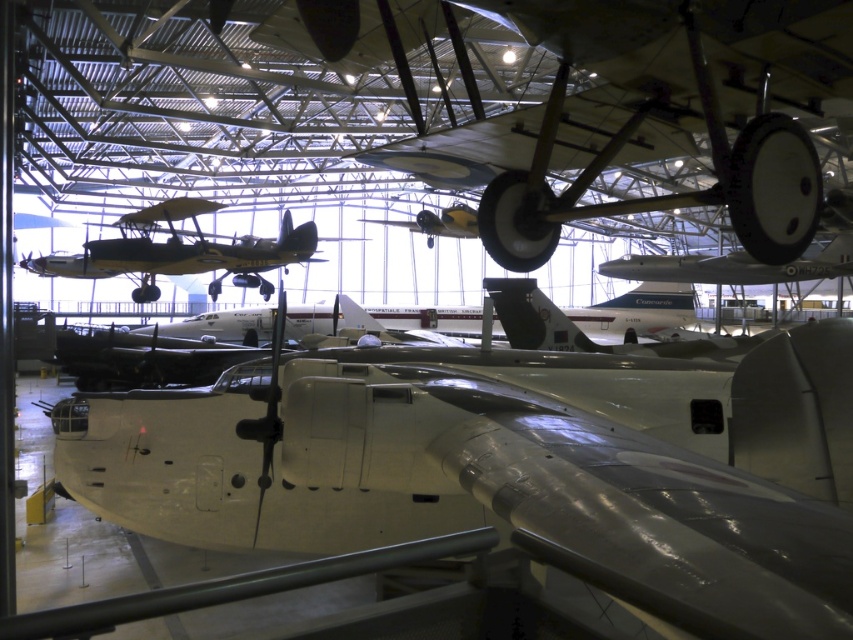
Question: Is the position of metallic silver airplane at center more distant than that of shiny silver airplane at center?

Choices:
 (A) yes
 (B) no

Answer: (B)

Question: Among these points, which one is farthest from the camera?

Choices:
 (A) (306, 224)
 (B) (467, 228)

Answer: (B)

Question: Estimate the real-world distances between objects in this image. Which object is closer to the metallic silver airplane at center?

Choices:
 (A) yellow matte airplane at center
 (B) shiny silver airplane at center

Answer: (B)

Question: Is metallic silver airplane at center wider than shiny silver airplane at center?

Choices:
 (A) no
 (B) yes

Answer: (B)

Question: Which point is closer to the camera?

Choices:
 (A) [662, 582]
 (B) [427, 243]

Answer: (A)

Question: Can you confirm if shiny silver airplane at center is positioned to the right of yellow matte airplane at center?

Choices:
 (A) yes
 (B) no

Answer: (B)